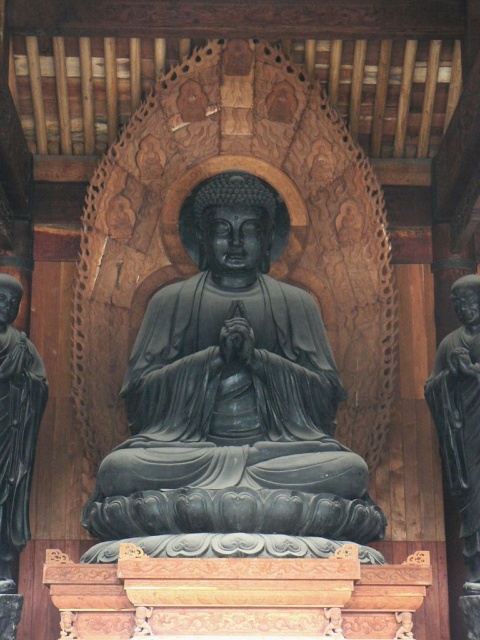
Who is lower down, black polished stone buddha at center or matte black statue at left?

matte black statue at left

Does point (168, 456) come behind point (4, 419)?

No, (168, 456) is in front of (4, 419).

At what (x,y) coordinates should I click in order to perform the action: click on black polished stone buddha at center. Please return your answer as a coordinate pair (x, y). Looking at the image, I should click on (230, 408).

Image resolution: width=480 pixels, height=640 pixels. I want to click on black polished stone buddha at center, so click(230, 408).

Does point (472, 371) lie in front of point (10, 426)?

No.

Between black stone statue at right and matte black statue at left, which one has more height?

black stone statue at right is taller.

What do you see at coordinates (460, 417) in the screenshot? The image size is (480, 640). I see `black stone statue at right` at bounding box center [460, 417].

You are a GUI agent. You are given a task and a screenshot of the screen. Output one action in this format:
    pyautogui.click(x=<x>, y=<y>)
    Task: Click on the black stone statue at right
    The height and width of the screenshot is (640, 480).
    Given the screenshot: What is the action you would take?
    pyautogui.click(x=460, y=417)

Is black polished stone buddha at center above black stone statue at right?

Yes, black polished stone buddha at center is above black stone statue at right.

Where is `black polished stone buddha at center`? The height and width of the screenshot is (640, 480). black polished stone buddha at center is located at coordinates pos(230,408).

Where is `black polished stone buddha at center`? The height and width of the screenshot is (640, 480). black polished stone buddha at center is located at coordinates (230, 408).